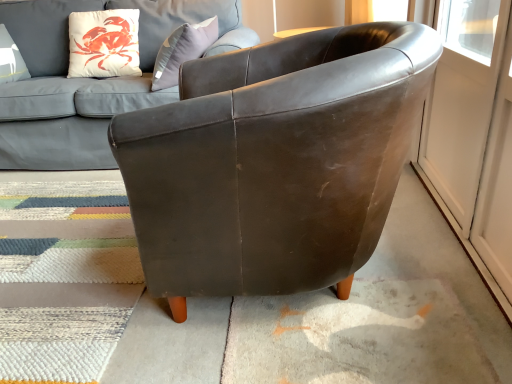
Question: Considering their positions, is textured wool mat at lower left located in front of or behind matte leather couch at upper center?

Choices:
 (A) behind
 (B) front

Answer: (B)

Question: From a real-world perspective, is textured wool mat at lower left positioned above or below matte leather couch at upper center?

Choices:
 (A) above
 (B) below

Answer: (B)

Question: Which object is the farthest from the white glossy screen door at right?

Choices:
 (A) matte leather couch at upper center
 (B) leather chair at center
 (C) textured wool mat at lower left

Answer: (A)

Question: Which object is positioned closest to the white glossy screen door at right?

Choices:
 (A) matte leather couch at upper center
 (B) textured wool mat at lower left
 (C) leather chair at center

Answer: (C)